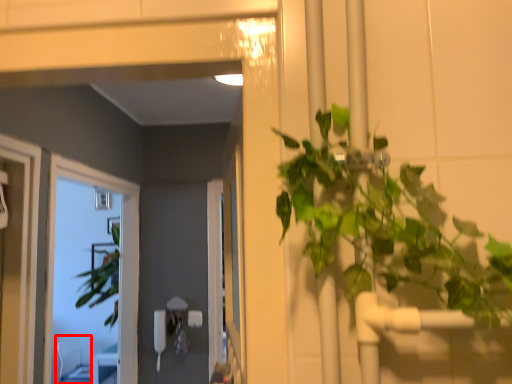
Question: Considering the relative positions of chair (annotated by the red box) and window in the image provided, where is chair (annotated by the red box) located with respect to the staircase?

Choices:
 (A) left
 (B) right

Answer: (A)